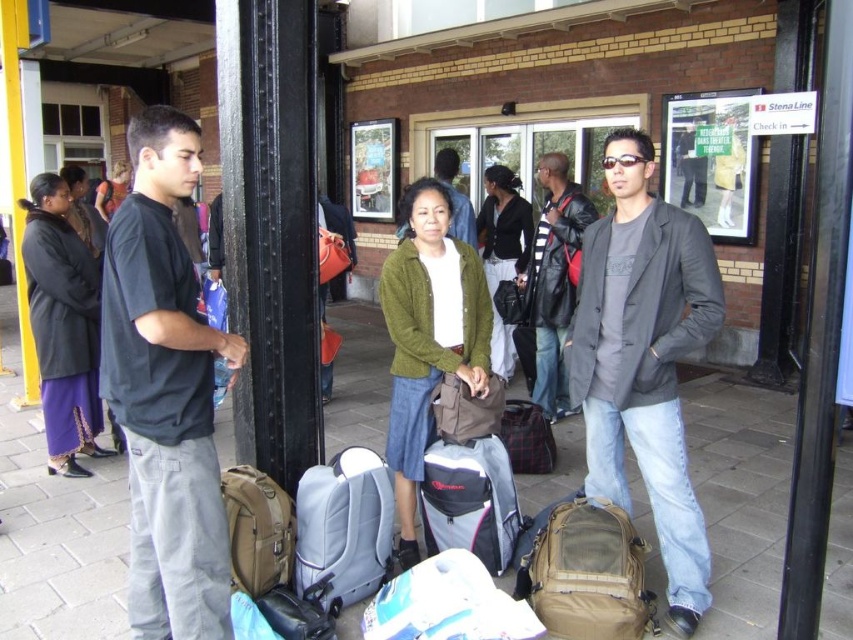
Is tan canvas backpack at lower left in front of dark gray jacket at center?

Yes, it is.

Between tan canvas backpack at lower left and dark gray jacket at center, which one has less height?

With less height is tan canvas backpack at lower left.

Locate an element on the screen. tan canvas backpack at lower left is located at coordinates (257, 529).

Who is higher up, leather jacket at center or plaid fabric bag at center?

leather jacket at center

Is leather jacket at center below plaid fabric bag at center?

Incorrect, leather jacket at center is not positioned below plaid fabric bag at center.

What do you see at coordinates (554, 278) in the screenshot? I see `leather jacket at center` at bounding box center [554, 278].

At what (x,y) coordinates should I click in order to perform the action: click on leather jacket at center. Please return your answer as a coordinate pair (x, y). The image size is (853, 640). Looking at the image, I should click on (554, 278).

Who is taller, light gray fabric suitcase at center or brown fabric bag at center?

With more height is light gray fabric suitcase at center.

Is light gray fabric suitcase at center below brown fabric bag at center?

Indeed, light gray fabric suitcase at center is positioned under brown fabric bag at center.

What do you see at coordinates (343, 529) in the screenshot?
I see `light gray fabric suitcase at center` at bounding box center [343, 529].

At what (x,y) coordinates should I click in order to perform the action: click on light gray fabric suitcase at center. Please return your answer as a coordinate pair (x, y). Looking at the image, I should click on (343, 529).